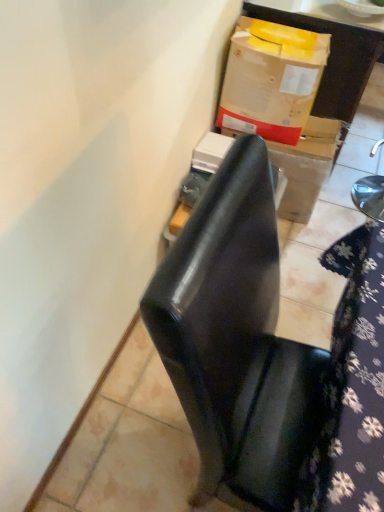
Question: Should I look upward or downward to see matte cardboard box at upper right?

Choices:
 (A) down
 (B) up

Answer: (B)

Question: From the image's perspective, is glossy black chair at center on cardboard box at upper right?

Choices:
 (A) no
 (B) yes

Answer: (A)

Question: Can you see glossy black chair at center touching cardboard box at upper right?

Choices:
 (A) no
 (B) yes

Answer: (A)

Question: Is glossy black chair at center facing away from cardboard box at upper right?

Choices:
 (A) yes
 (B) no

Answer: (B)

Question: Is glossy black chair at center shorter than cardboard box at upper right?

Choices:
 (A) yes
 (B) no

Answer: (B)

Question: Is glossy black chair at center oriented towards cardboard box at upper right?

Choices:
 (A) yes
 (B) no

Answer: (B)

Question: Is cardboard box at upper right surrounded by glossy black chair at center?

Choices:
 (A) yes
 (B) no

Answer: (B)

Question: Are matte cardboard box at upper right and floral fabric at lower right far apart?

Choices:
 (A) no
 (B) yes

Answer: (B)

Question: Considering the relative sizes of matte cardboard box at upper right and floral fabric at lower right in the image provided, is matte cardboard box at upper right bigger than floral fabric at lower right?

Choices:
 (A) yes
 (B) no

Answer: (A)

Question: Is the position of matte cardboard box at upper right less distant than that of floral fabric at lower right?

Choices:
 (A) yes
 (B) no

Answer: (B)

Question: From a real-world perspective, is matte cardboard box at upper right over floral fabric at lower right?

Choices:
 (A) yes
 (B) no

Answer: (B)

Question: Is matte cardboard box at upper right facing towards floral fabric at lower right?

Choices:
 (A) yes
 (B) no

Answer: (A)

Question: Is matte cardboard box at upper right facing away from floral fabric at lower right?

Choices:
 (A) yes
 (B) no

Answer: (B)

Question: Is glossy black chair at center inside cardboard box at upper right?

Choices:
 (A) yes
 (B) no

Answer: (B)